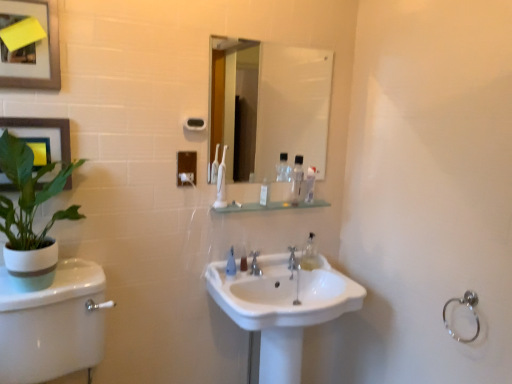
Question: Can you confirm if white glossy toilet tank at lower left is smaller than matte black picture frame at upper left, the 1th picture frame when ordered from bottom to top?

Choices:
 (A) yes
 (B) no

Answer: (B)

Question: Considering the relative sizes of white glossy toilet tank at lower left and matte black picture frame at upper left, the second picture frame positioned from the top, in the image provided, is white glossy toilet tank at lower left shorter than matte black picture frame at upper left, the second picture frame positioned from the top,?

Choices:
 (A) no
 (B) yes

Answer: (A)

Question: Would you say white glossy toilet tank at lower left contains matte black picture frame at upper left, the second picture frame positioned from the top?

Choices:
 (A) yes
 (B) no

Answer: (B)

Question: Considering the relative positions of white glossy toilet tank at lower left and matte black picture frame at upper left, the second picture frame positioned from the top, in the image provided, is white glossy toilet tank at lower left to the left of matte black picture frame at upper left, the second picture frame positioned from the top, from the viewer's perspective?

Choices:
 (A) no
 (B) yes

Answer: (A)

Question: Is white glossy toilet tank at lower left at the right side of matte black picture frame at upper left, the 1th picture frame when ordered from bottom to top?

Choices:
 (A) yes
 (B) no

Answer: (A)

Question: Are white glossy toilet tank at lower left and matte black picture frame at upper left, the 1th picture frame when ordered from bottom to top, far apart?

Choices:
 (A) no
 (B) yes

Answer: (A)

Question: From the image's perspective, is silver metallic towel bar at upper center above white glossy mirror at upper center?

Choices:
 (A) no
 (B) yes

Answer: (A)

Question: From a real-world perspective, is silver metallic towel bar at upper center beneath white glossy mirror at upper center?

Choices:
 (A) yes
 (B) no

Answer: (A)

Question: From a real-world perspective, is silver metallic towel bar at upper center on white glossy mirror at upper center?

Choices:
 (A) no
 (B) yes

Answer: (A)

Question: Is silver metallic towel bar at upper center closer to the viewer compared to white glossy mirror at upper center?

Choices:
 (A) no
 (B) yes

Answer: (B)

Question: Can you see silver metallic towel bar at upper center touching white glossy mirror at upper center?

Choices:
 (A) no
 (B) yes

Answer: (A)

Question: Is silver metallic towel bar at upper center to the left of white glossy mirror at upper center from the viewer's perspective?

Choices:
 (A) yes
 (B) no

Answer: (A)

Question: Can you confirm if white plastic tube at center is smaller than white glossy mirror at upper center?

Choices:
 (A) no
 (B) yes

Answer: (B)